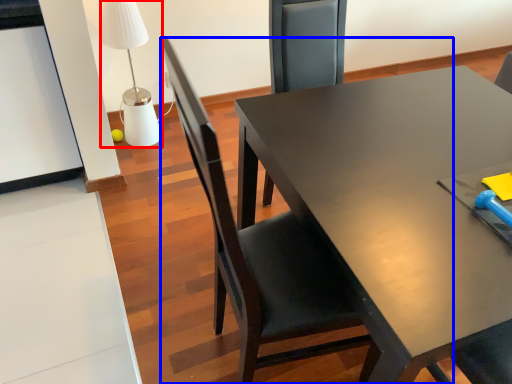
Question: Which object is further to the camera taking this photo, table lamp (highlighted by a red box) or chair (highlighted by a blue box)?

Choices:
 (A) table lamp
 (B) chair

Answer: (A)